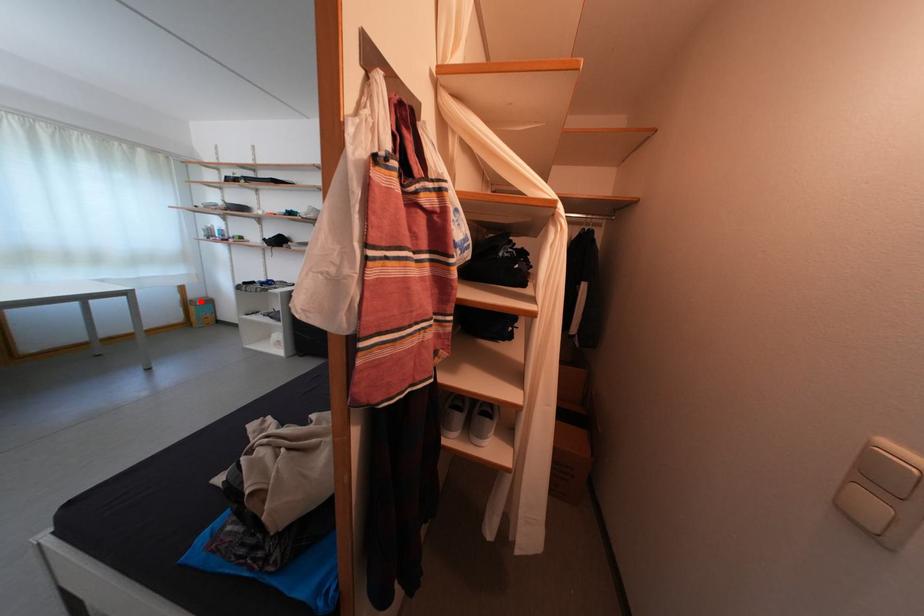
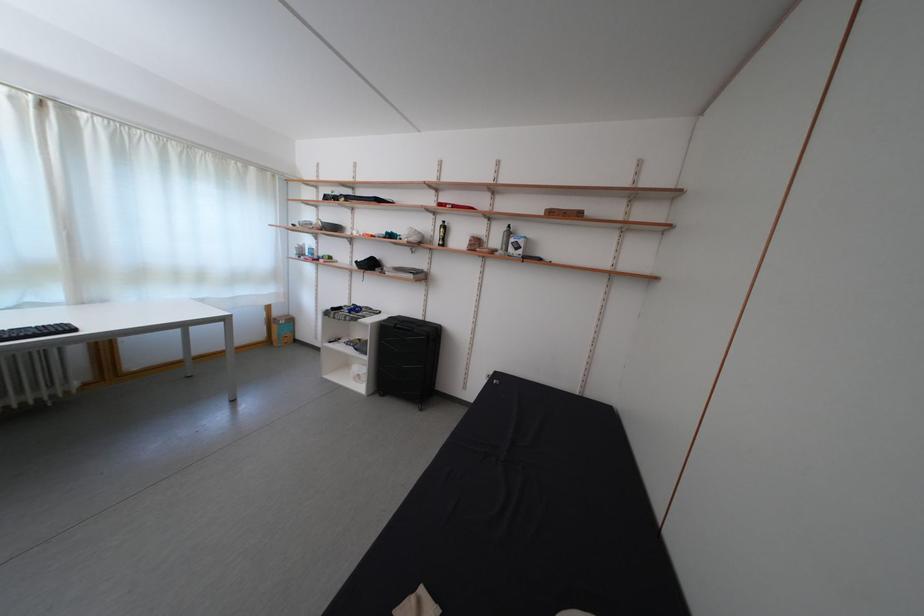
Question: I am providing you with two images of the same scene from different viewpoints. In image1, a red point is highlighted. Considering the same 3D point in image2, which of the following is correct?

Choices:
 (A) It is closer
 (B) It is farther

Answer: (B)